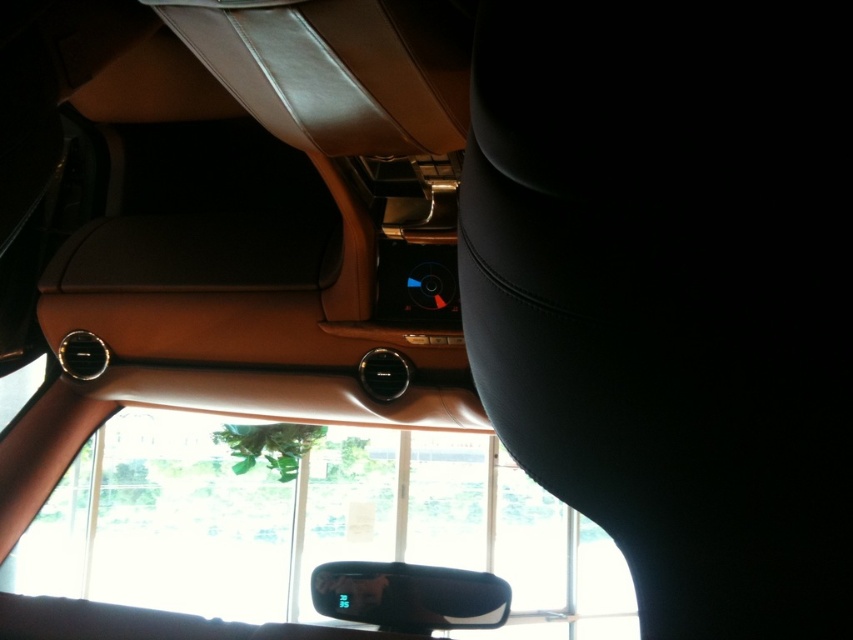
Is black leather seat at center to the left of black glossy rearview mirror at center from the viewer's perspective?

No, black leather seat at center is not to the left of black glossy rearview mirror at center.

Describe the element at coordinates (672, 291) in the screenshot. I see `black leather seat at center` at that location.

Which is in front, point (718, 611) or point (480, 620)?

Positioned in front is point (718, 611).

Identify the location of black leather seat at center. The height and width of the screenshot is (640, 853). (672, 291).